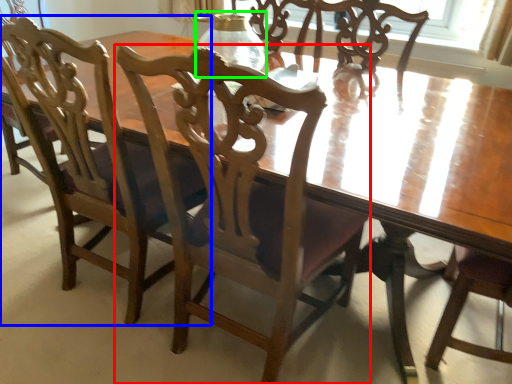
Question: Estimate the real-world distances between objects in this image. Which object is farther from chair (highlighted by a red box), chair (highlighted by a blue box) or glass vase (highlighted by a green box)?

Choices:
 (A) chair
 (B) glass vase

Answer: (B)